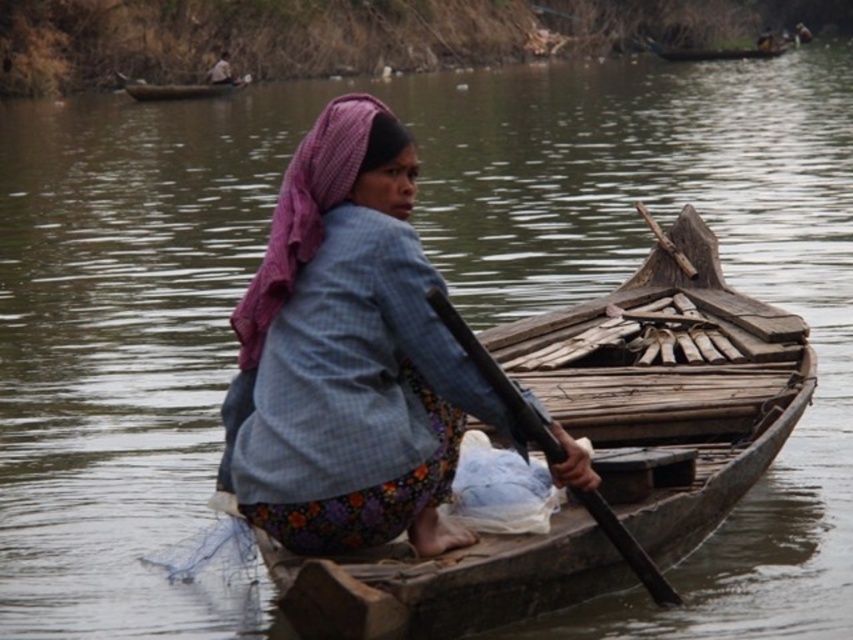
Question: Observing the image, what is the correct spatial positioning of wooden boat at center in reference to black wood paddle at center?

Choices:
 (A) right
 (B) left

Answer: (A)

Question: Is black wood paddle at center further to the viewer compared to wooden boat at upper left?

Choices:
 (A) no
 (B) yes

Answer: (A)

Question: Which point is closer to the camera?

Choices:
 (A) (784, 44)
 (B) (556, 440)
 (C) (747, 458)

Answer: (B)

Question: Can you confirm if wooden boat at center is wider than black wood paddle at center?

Choices:
 (A) yes
 (B) no

Answer: (A)

Question: Which point is closer to the camera taking this photo?

Choices:
 (A) (215, 88)
 (B) (697, 275)

Answer: (B)

Question: Which of the following is the closest to the observer?

Choices:
 (A) (180, 84)
 (B) (727, 58)
 (C) (302, 234)

Answer: (C)